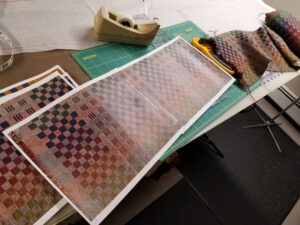
Where is `floor`? Image resolution: width=300 pixels, height=225 pixels. floor is located at coordinates (146, 194), (292, 219).